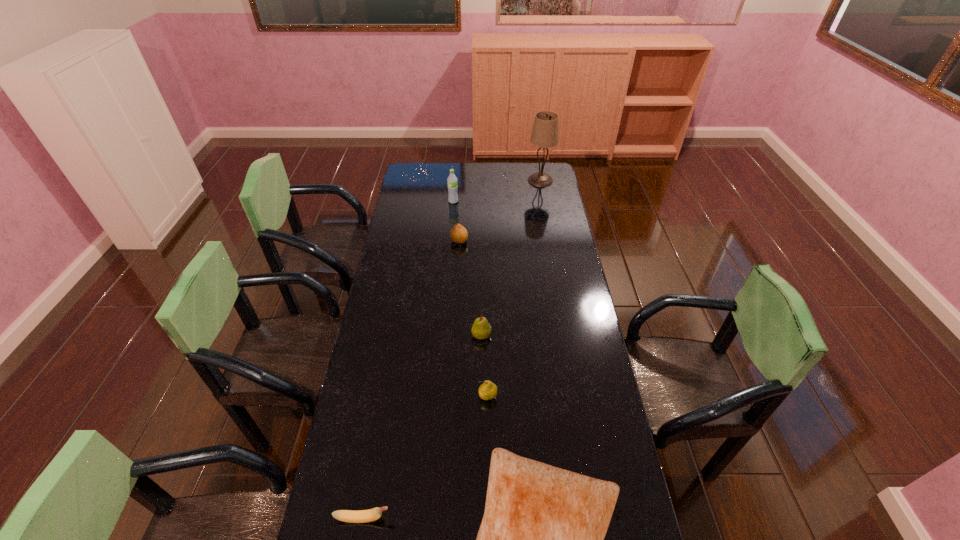
In order to click on the farthest object in this screenshot , I will do `click(545, 134)`.

The image size is (960, 540). I want to click on lampshade, so click(545, 134).

The width and height of the screenshot is (960, 540). What are the coordinates of `water bottle` in the screenshot? It's located at (452, 185).

You are a GUI agent. You are given a task and a screenshot of the screen. Output one action in this format:
    pyautogui.click(x=<x>, y=<y>)
    Task: Click on the sixth nearest object
    
    Given the screenshot: What is the action you would take?
    pyautogui.click(x=452, y=185)

I want to click on the third farthest object, so (x=459, y=235).

Locate an element on the screen. the farthest pear is located at coordinates (459, 235).

Where is `the second nearest pear`? This screenshot has height=540, width=960. the second nearest pear is located at coordinates (481, 329).

You are a GUI agent. You are given a task and a screenshot of the screen. Output one action in this format:
    pyautogui.click(x=<x>, y=<y>)
    Task: Click on the fifth farthest object
    This screenshot has width=960, height=540.
    Given the screenshot: What is the action you would take?
    pyautogui.click(x=488, y=390)

Identify the location of the leftmost object. The width and height of the screenshot is (960, 540). (362, 516).

The height and width of the screenshot is (540, 960). Find the location of `free space located 0.100m on the front-facing side of the tallest object`. free space located 0.100m on the front-facing side of the tallest object is located at coordinates (509, 180).